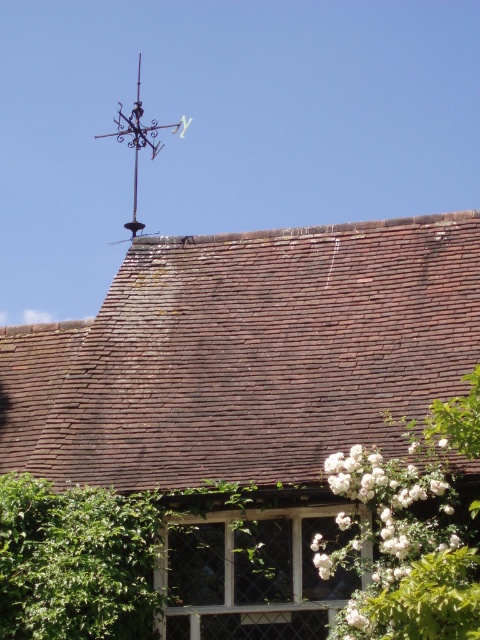
Question: Which point is closer to the camera taking this photo?

Choices:
 (A) (100, 310)
 (B) (123, 116)

Answer: (A)

Question: Is brown tile roof at upper center smaller than black wrought iron vane at upper left?

Choices:
 (A) no
 (B) yes

Answer: (B)

Question: Among these points, which one is nearest to the camera?

Choices:
 (A) tap(10, 513)
 (B) tap(51, 372)

Answer: (A)

Question: Can you confirm if green leafy hedge at lower left is smaller than black wrought iron vane at upper left?

Choices:
 (A) no
 (B) yes

Answer: (B)

Question: Does brown tile roof at upper center have a larger size compared to black wrought iron vane at upper left?

Choices:
 (A) no
 (B) yes

Answer: (A)

Question: Which of the following is the closest to the observer?

Choices:
 (A) (142, 227)
 (B) (94, 515)

Answer: (B)